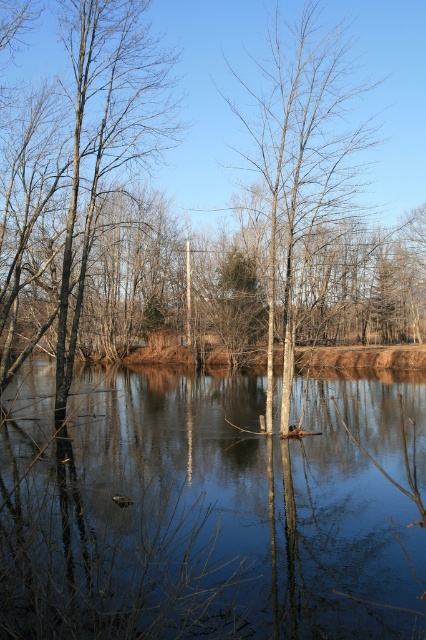
Is point (8, 465) more distant than point (285, 65)?

No, (8, 465) is in front of (285, 65).

Between point (379, 397) and point (314, 228), which one is positioned behind?

Positioned behind is point (379, 397).

Is point (359, 586) closer to camera compared to point (265, 172)?

Yes, point (359, 586) is in front of point (265, 172).

The width and height of the screenshot is (426, 640). What are the coordinates of `transparent water at center` in the screenshot? It's located at (209, 509).

Is brown bark tree at left wider than bare wood tree at center?

Correct, the width of brown bark tree at left exceeds that of bare wood tree at center.

Does brown bark tree at left lie behind bare wood tree at center?

Yes, brown bark tree at left is further from the viewer.

Does point (25, 349) lie in front of point (314, 29)?

No.

Locate an element on the screen. brown bark tree at left is located at coordinates (81, 170).

Between transparent water at center and brown bark tree at left, which one appears on the right side from the viewer's perspective?

From the viewer's perspective, transparent water at center appears more on the right side.

Is transparent water at center wider than brown bark tree at left?

Yes, transparent water at center is wider than brown bark tree at left.

The height and width of the screenshot is (640, 426). In order to click on transparent water at center in this screenshot , I will do `click(209, 509)`.